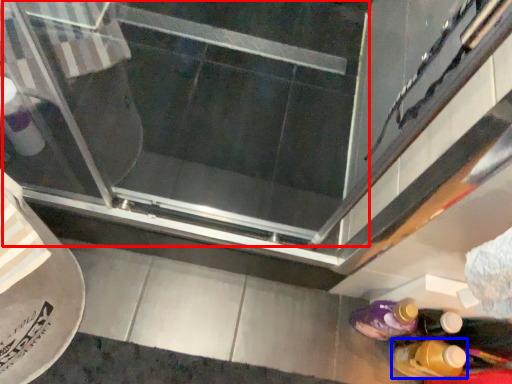
Question: Which point is further to the camera, screen door (highlighted by a red box) or bottle (highlighted by a blue box)?

Choices:
 (A) screen door
 (B) bottle

Answer: (A)